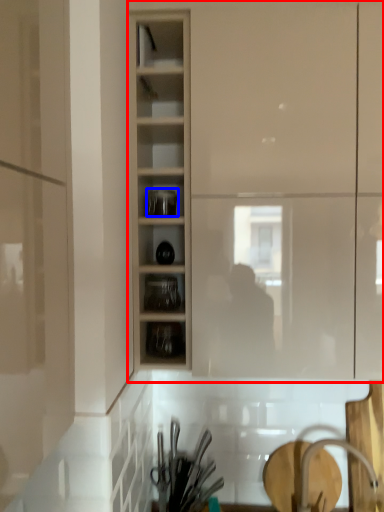
Question: Among these objects, which one is nearest to the camera, cupboard (highlighted by a red box) or tableware (highlighted by a blue box)?

Choices:
 (A) cupboard
 (B) tableware

Answer: (A)